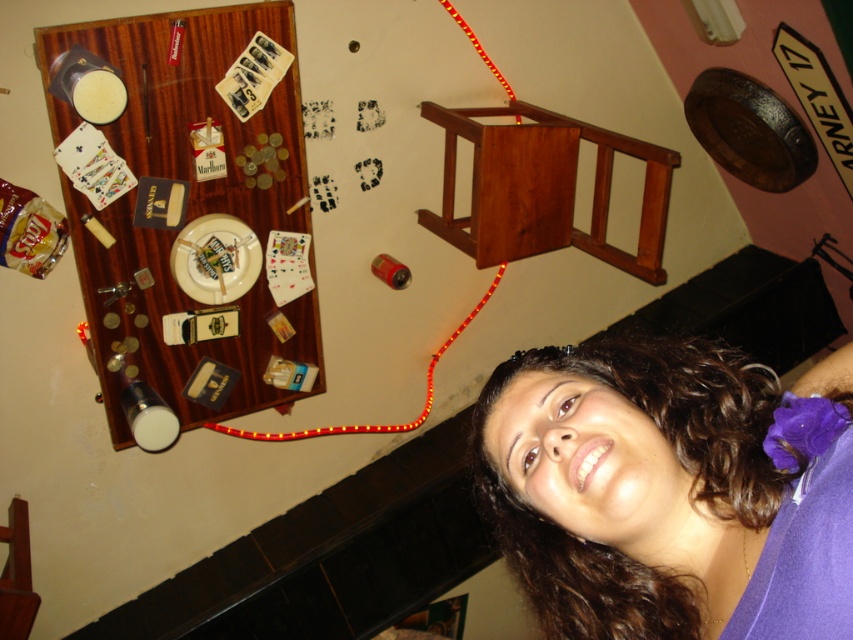
Is dark brown hair at upper right taller than red led strip at center?

In fact, dark brown hair at upper right may be shorter than red led strip at center.

Does dark brown hair at upper right appear on the right side of red led strip at center?

Yes, dark brown hair at upper right is to the right of red led strip at center.

The width and height of the screenshot is (853, 640). Describe the element at coordinates (670, 490) in the screenshot. I see `dark brown hair at upper right` at that location.

This screenshot has width=853, height=640. I want to click on dark brown hair at upper right, so click(670, 490).